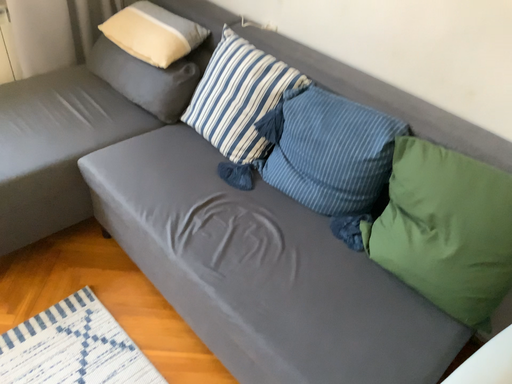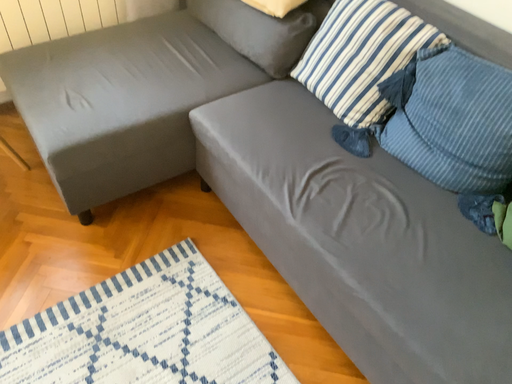
Question: How did the camera likely rotate when shooting the video?

Choices:
 (A) rotated right
 (B) rotated left

Answer: (B)